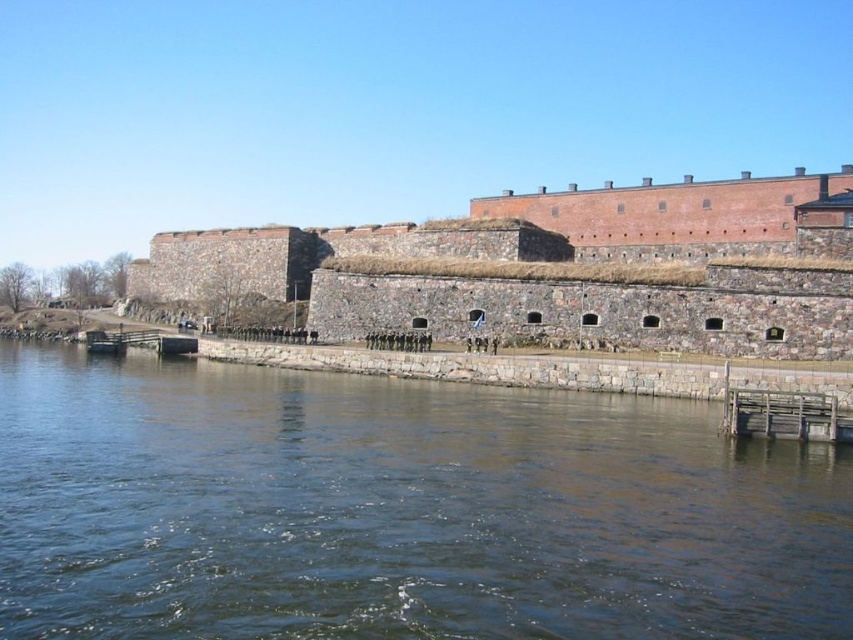
Question: Which is nearer to the wooden dock at lower left?

Choices:
 (A) dark blue water at center
 (B) wooden planks at lower right

Answer: (A)

Question: Is brown stone castle at center positioned behind wooden dock at lower left?

Choices:
 (A) no
 (B) yes

Answer: (A)

Question: Which of the following is the farthest from the observer?

Choices:
 (A) (432, 243)
 (B) (148, 342)
 (C) (177, 493)

Answer: (A)

Question: Is dark blue water at center in front of wooden dock at lower left?

Choices:
 (A) no
 (B) yes

Answer: (B)

Question: Is brown stone castle at center below wooden dock at lower left?

Choices:
 (A) yes
 (B) no

Answer: (B)

Question: Among these points, which one is farthest from the camera?

Choices:
 (A) (117, 337)
 (B) (822, 403)

Answer: (A)